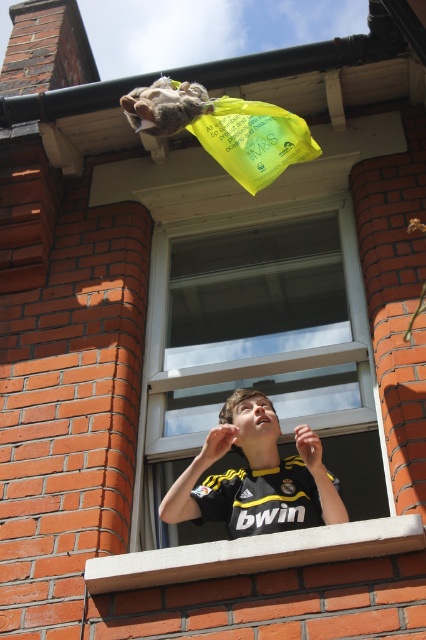
Who is higher up, black jersey at center or fuzzy fur at upper center?

fuzzy fur at upper center is above.

Is point (259, 436) positioned behind point (198, 112)?

That is False.

Image resolution: width=426 pixels, height=640 pixels. I want to click on black jersey at center, so click(256, 476).

Which of these two, transparent glass window at center or translucent yellow plastic bag at upper center, stands shorter?

translucent yellow plastic bag at upper center

Is transparent glass window at center above translucent yellow plastic bag at upper center?

Actually, transparent glass window at center is below translucent yellow plastic bag at upper center.

Does point (360, 368) come farther from viewer compared to point (264, 154)?

Yes, it is behind point (264, 154).

Identify the location of transparent glass window at center. (250, 337).

Which is below, transparent glass window at center or fuzzy fur at upper center?

transparent glass window at center is below.

Does transparent glass window at center have a greater height compared to fuzzy fur at upper center?

A: Indeed, transparent glass window at center has a greater height compared to fuzzy fur at upper center.

Where is `transparent glass window at center`? This screenshot has width=426, height=640. transparent glass window at center is located at coordinates (250, 337).

Image resolution: width=426 pixels, height=640 pixels. I want to click on transparent glass window at center, so click(250, 337).